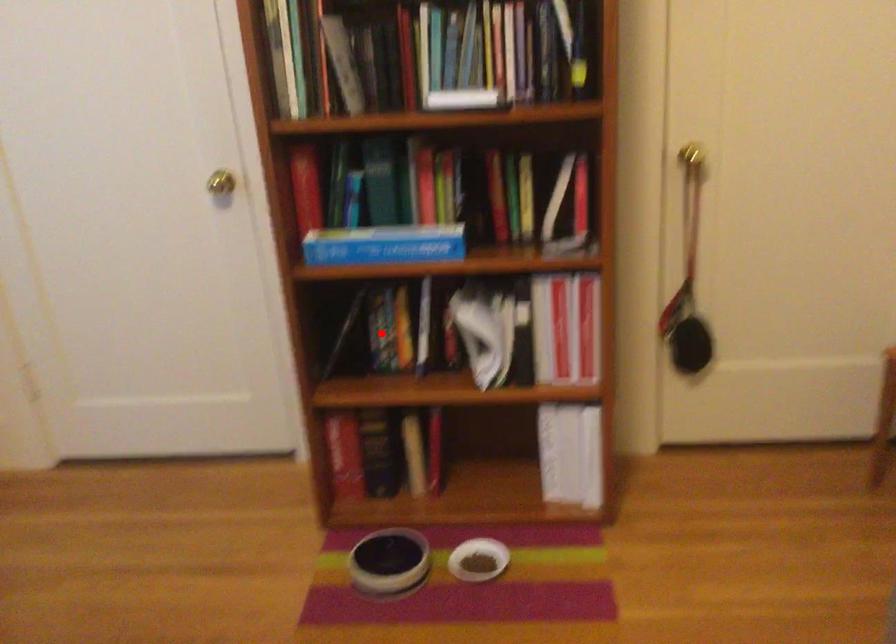
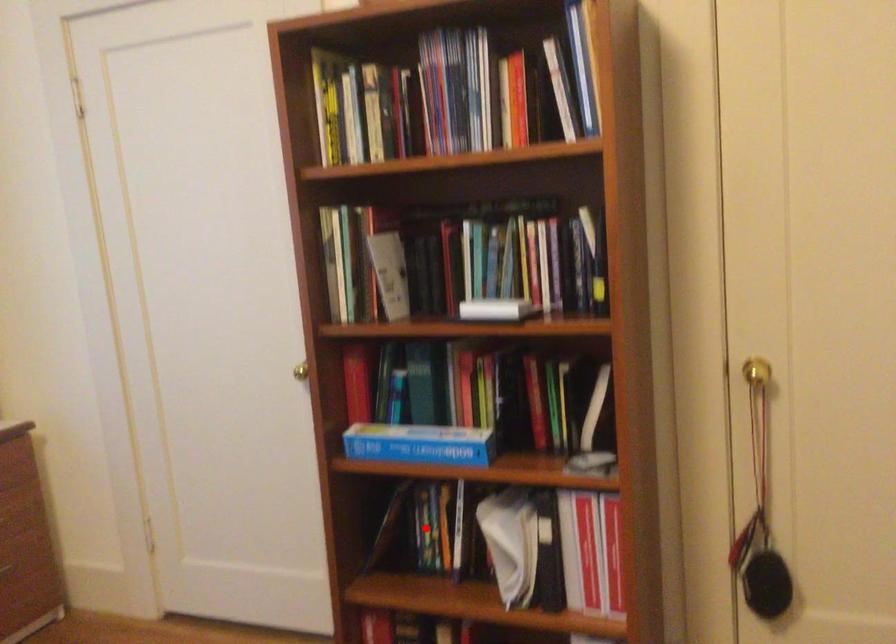
Based on the photo, I am providing you with two images of the same scene from different viewpoints. A red point is marked on the first image and another point is marked on the second image. Are the points marked in image1 and image2 representing the same 3D position?

Yes